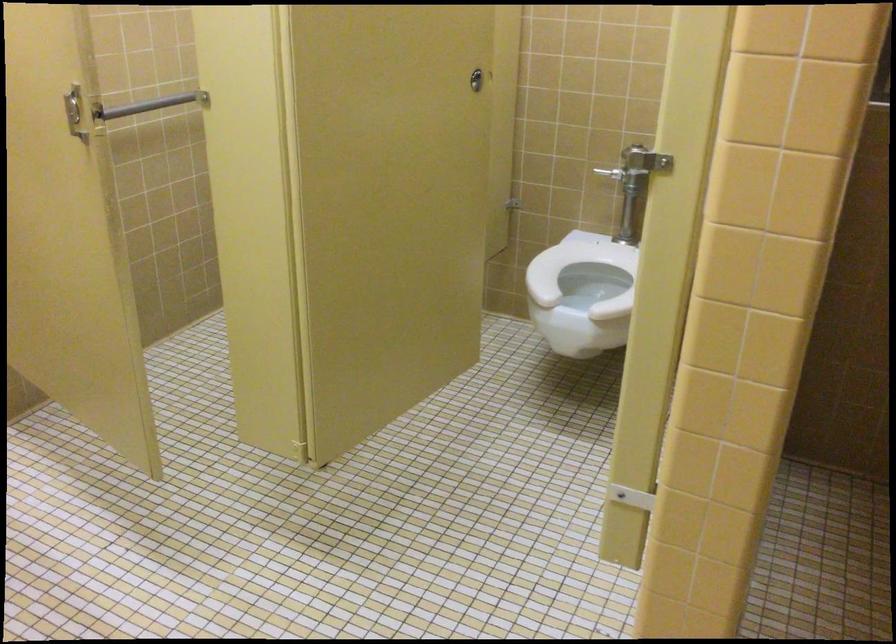
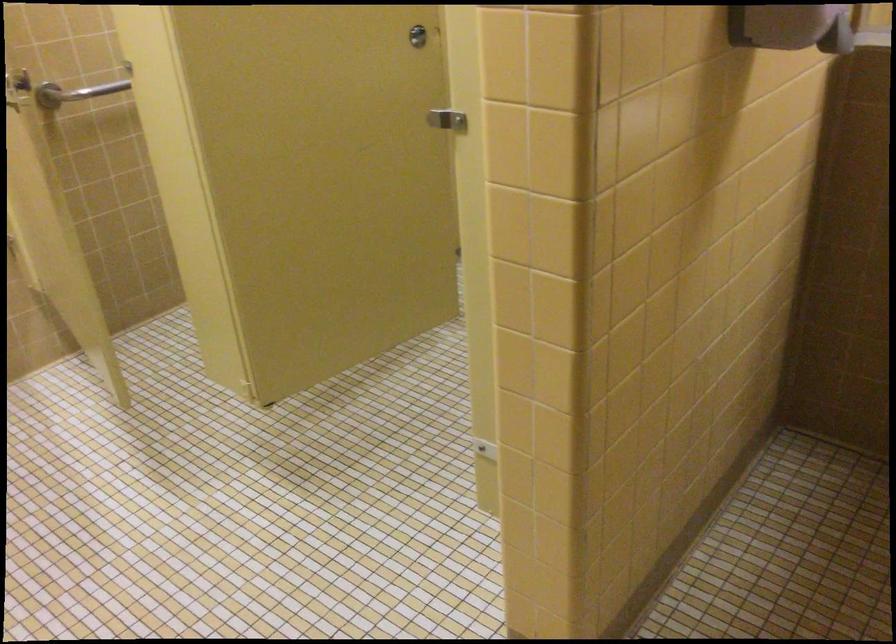
Question: I am providing you with two images of the same scene from different viewpoints. Please identify which objects are invisible in image2.

Choices:
 (A) metal grab bar
 (B) stall door latch
 (C) white toilet seat
 (D) blind adjustment cord

Answer: (C)